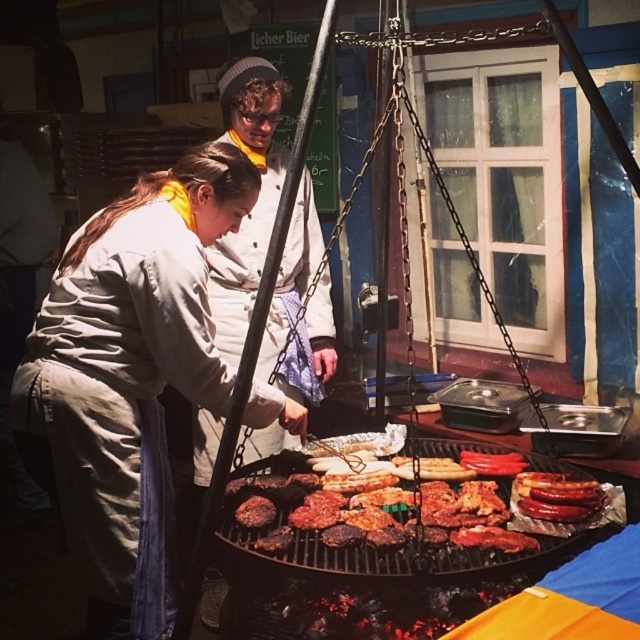
In the scene shown: You are standing at the position of the first cook near the grill. You need to reach a spice rack located at point (81, 449) and a tool drawer at point (435, 545). Which location is closer to you?

Point 0.702, 0.127 is behind point (435, 545), so the tool drawer at (435, 545) is closer to you.

You are a food safety inspector checking the distance between the matte white apron at center and the charred meat at center. According to health regulations, the minimum safe distance between food and aprons must be at least 24 inches to prevent contamination. Is the current distance compliant?

The matte white apron at center and charred meat at center are 22.83 inches apart, which is less than the required 24 inches. Therefore, the current distance does not comply with health regulations.